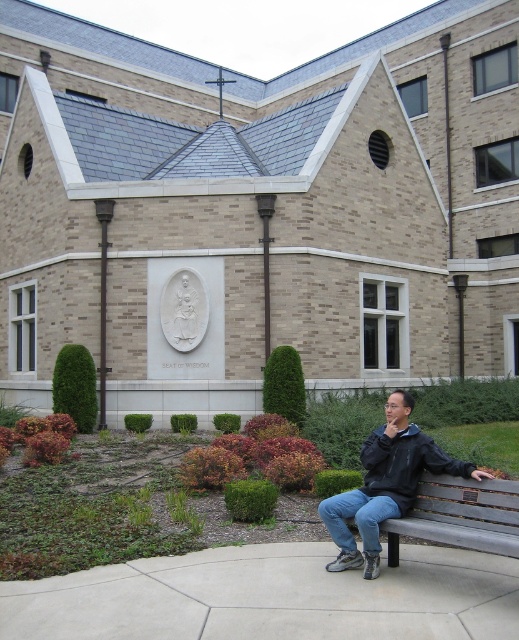
Does black matte jacket at lower right appear on the right side of wooden bench at lower right?

Incorrect, black matte jacket at lower right is not on the right side of wooden bench at lower right.

Does point (407, 420) lie in front of point (472, 541)?

No.

The image size is (519, 640). What do you see at coordinates (386, 484) in the screenshot? I see `black matte jacket at lower right` at bounding box center [386, 484].

Where is `black matte jacket at lower right`? The height and width of the screenshot is (640, 519). black matte jacket at lower right is located at coordinates (386, 484).

Which is above, black matte jacket at lower right or metallic plaque at lower right?

Positioned higher is metallic plaque at lower right.

From the picture: Is black matte jacket at lower right shorter than metallic plaque at lower right?

No, black matte jacket at lower right is not shorter than metallic plaque at lower right.

Who is more distant from viewer, (359, 524) or (463, 499)?

Positioned behind is point (463, 499).

Locate an element on the screen. This screenshot has height=640, width=519. black matte jacket at lower right is located at coordinates (386, 484).

Is wooden bench at lower right shorter than metallic plaque at lower right?

No, wooden bench at lower right is not shorter than metallic plaque at lower right.

Which is behind, point (443, 513) or point (465, 492)?

Point (443, 513)

I want to click on wooden bench at lower right, so click(459, 515).